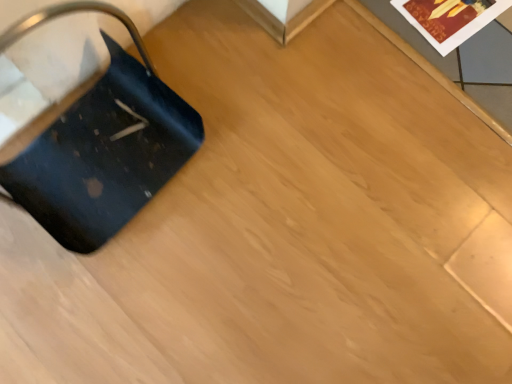
Question: Can you confirm if matte black suitcase at left is shorter than matte paper postcard at upper right?

Choices:
 (A) yes
 (B) no

Answer: (B)

Question: Is matte black suitcase at left aimed at matte paper postcard at upper right?

Choices:
 (A) no
 (B) yes

Answer: (A)

Question: From a real-world perspective, does matte black suitcase at left sit lower than matte paper postcard at upper right?

Choices:
 (A) no
 (B) yes

Answer: (A)

Question: From a real-world perspective, is matte black suitcase at left on top of matte paper postcard at upper right?

Choices:
 (A) yes
 (B) no

Answer: (A)

Question: Is matte black suitcase at left smaller than matte paper postcard at upper right?

Choices:
 (A) no
 (B) yes

Answer: (A)

Question: From the image's perspective, is matte black suitcase at left below matte paper postcard at upper right?

Choices:
 (A) no
 (B) yes

Answer: (B)

Question: Considering the relative sizes of matte paper postcard at upper right and matte black suitcase at left in the image provided, is matte paper postcard at upper right wider than matte black suitcase at left?

Choices:
 (A) no
 (B) yes

Answer: (A)

Question: Is the depth of matte paper postcard at upper right less than that of matte black suitcase at left?

Choices:
 (A) no
 (B) yes

Answer: (A)

Question: Is matte paper postcard at upper right taller than matte black suitcase at left?

Choices:
 (A) no
 (B) yes

Answer: (A)

Question: Can you confirm if matte paper postcard at upper right is positioned to the right of matte black suitcase at left?

Choices:
 (A) no
 (B) yes

Answer: (B)

Question: From the image's perspective, would you say matte paper postcard at upper right is positioned over matte black suitcase at left?

Choices:
 (A) no
 (B) yes

Answer: (B)

Question: From the image's perspective, is matte paper postcard at upper right beneath matte black suitcase at left?

Choices:
 (A) yes
 (B) no

Answer: (B)

Question: From a real-world perspective, relative to matte black suitcase at left, is matte paper postcard at upper right vertically above or below?

Choices:
 (A) above
 (B) below

Answer: (B)